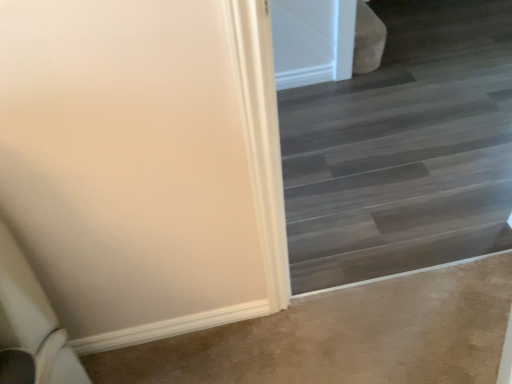
Question: Should I look upward or downward to see dark wood floor at center?

Choices:
 (A) down
 (B) up

Answer: (B)

Question: Is brown carpet at lower left shorter than dark wood floor at center?

Choices:
 (A) yes
 (B) no

Answer: (A)

Question: Can you confirm if brown carpet at lower left is bigger than dark wood floor at center?

Choices:
 (A) no
 (B) yes

Answer: (A)

Question: Considering the relative positions of brown carpet at lower left and dark wood floor at center in the image provided, is brown carpet at lower left to the left of dark wood floor at center from the viewer's perspective?

Choices:
 (A) no
 (B) yes

Answer: (B)

Question: From a real-world perspective, is brown carpet at lower left physically above dark wood floor at center?

Choices:
 (A) no
 (B) yes

Answer: (A)

Question: Is the position of brown carpet at lower left less distant than that of dark wood floor at center?

Choices:
 (A) no
 (B) yes

Answer: (A)

Question: Is brown carpet at lower left next to dark wood floor at center and touching it?

Choices:
 (A) no
 (B) yes

Answer: (A)

Question: Does dark wood floor at center come behind brown carpet at lower left?

Choices:
 (A) yes
 (B) no

Answer: (B)

Question: From a real-world perspective, is dark wood floor at center under brown carpet at lower left?

Choices:
 (A) yes
 (B) no

Answer: (B)

Question: Is dark wood floor at center shorter than brown carpet at lower left?

Choices:
 (A) yes
 (B) no

Answer: (B)

Question: Is dark wood floor at center located outside brown carpet at lower left?

Choices:
 (A) no
 (B) yes

Answer: (B)

Question: Considering the relative sizes of dark wood floor at center and brown carpet at lower left in the image provided, is dark wood floor at center bigger than brown carpet at lower left?

Choices:
 (A) yes
 (B) no

Answer: (A)

Question: Is dark wood floor at center wider than brown carpet at lower left?

Choices:
 (A) yes
 (B) no

Answer: (B)

Question: Is brown carpet at lower left to the left or to the right of dark wood floor at center in the image?

Choices:
 (A) left
 (B) right

Answer: (A)